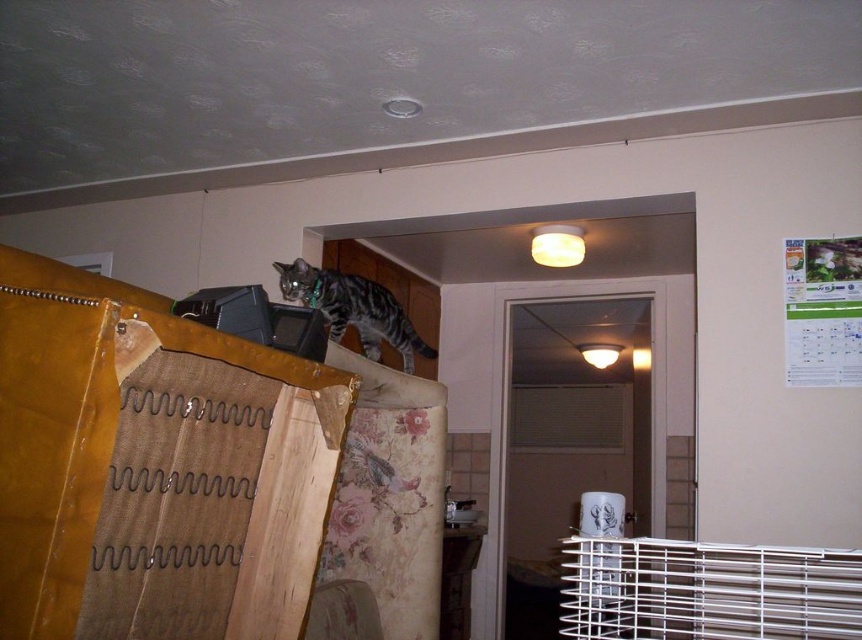
You are a pet owner who wants to move your tabby fur cat at upper left into the white metal cage at lower right. Based on their positions in the image, can you determine if the cat can jump down into the cage without any assistance?

The white metal cage at lower right is below the tabby fur cat at upper left, so the cat can jump down into the cage without assistance since it is positioned lower.

You are standing in the living room and want to move from the doorway to the cat. The doorway is near the point labeled as point (351, 324). The cat is on the furniture near point (601, 611). Which direction should you move to get closer to the cat?

To get closer to the cat near point (601, 611), you should move forward since point (601, 611) is in front of point (351, 324).